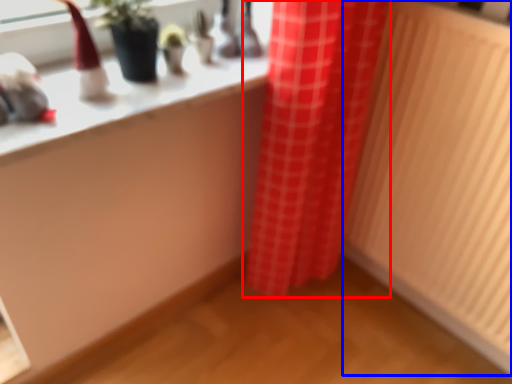
Question: Which point is further to the camera, curtain (highlighted by a red box) or radiator (highlighted by a blue box)?

Choices:
 (A) curtain
 (B) radiator

Answer: (A)